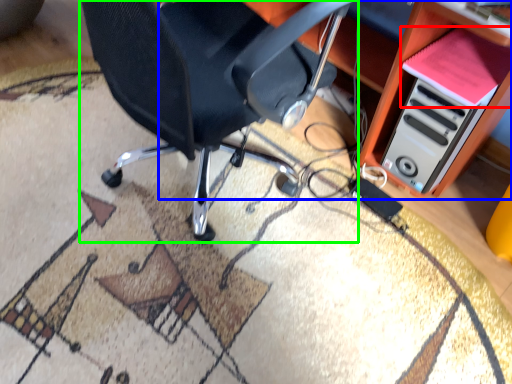
Question: Which object is the closest to the book (highlighted by a red box)? Choose among these: computer desk (highlighted by a blue box) or chair (highlighted by a green box).

Choices:
 (A) computer desk
 (B) chair

Answer: (A)